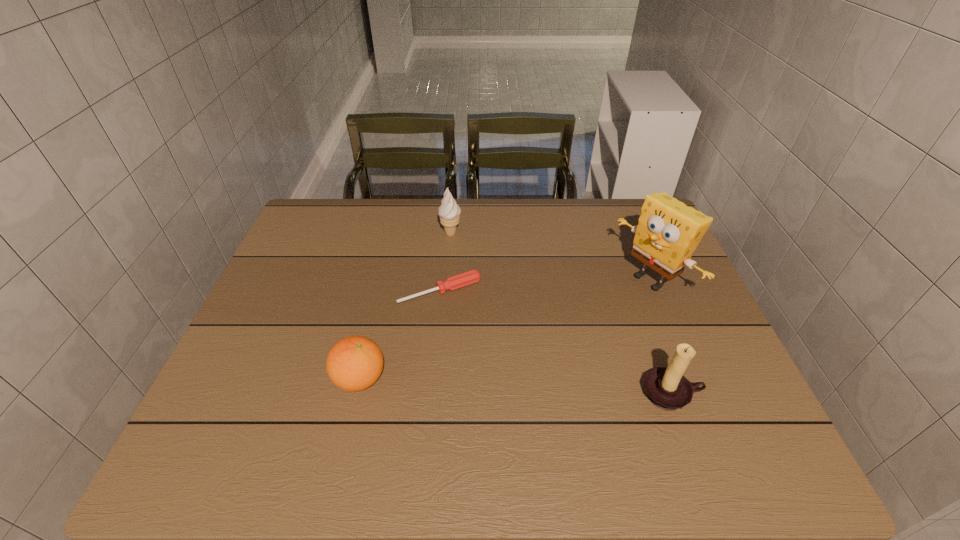
What are the coordinates of `free spot on the desktop that is between the fourth tallest object and the candle holder and is positioned on the front-facing side of the farthest object` in the screenshot? It's located at tap(468, 384).

Where is `free space on the desktop that is between the fourth tallest object and the candle holder and is positioned on the face of the tallest object`? The width and height of the screenshot is (960, 540). free space on the desktop that is between the fourth tallest object and the candle holder and is positioned on the face of the tallest object is located at coordinates (477, 384).

You are a GUI agent. You are given a task and a screenshot of the screen. Output one action in this format:
    pyautogui.click(x=<x>, y=<y>)
    Task: Click on the free spot on the desktop that is between the orange and the candle holder and is positioned at the tip of the shortest object
    The width and height of the screenshot is (960, 540).
    Given the screenshot: What is the action you would take?
    pyautogui.click(x=495, y=386)